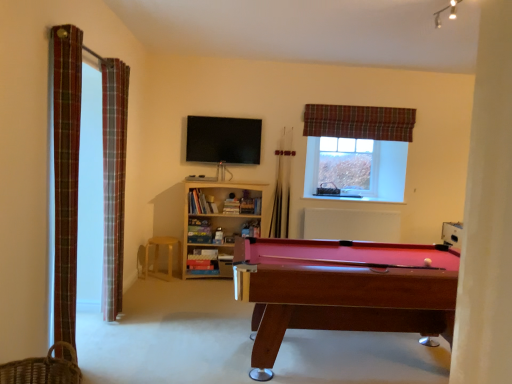
Question: Is rubberized wood pool table at lower right next to light wood/bookshelf at center and touching it?

Choices:
 (A) yes
 (B) no

Answer: (B)

Question: Is rubberized wood pool table at lower right thinner than light wood/bookshelf at center?

Choices:
 (A) no
 (B) yes

Answer: (A)

Question: Is rubberized wood pool table at lower right not near light wood/bookshelf at center?

Choices:
 (A) no
 (B) yes

Answer: (B)

Question: Considering the relative sizes of rubberized wood pool table at lower right and light wood/bookshelf at center in the image provided, is rubberized wood pool table at lower right shorter than light wood/bookshelf at center?

Choices:
 (A) no
 (B) yes

Answer: (B)

Question: From the image's perspective, is rubberized wood pool table at lower right beneath light wood/bookshelf at center?

Choices:
 (A) no
 (B) yes

Answer: (B)

Question: Is rubberized wood pool table at lower right to the right of light wood/bookshelf at center from the viewer's perspective?

Choices:
 (A) no
 (B) yes

Answer: (B)

Question: Is woven brown basket at lower left positioned beyond the bounds of clear plastic window screen at upper right?

Choices:
 (A) yes
 (B) no

Answer: (A)

Question: Is the depth of woven brown basket at lower left less than that of clear plastic window screen at upper right?

Choices:
 (A) no
 (B) yes

Answer: (B)

Question: Is woven brown basket at lower left looking in the opposite direction of clear plastic window screen at upper right?

Choices:
 (A) yes
 (B) no

Answer: (B)

Question: Does woven brown basket at lower left have a greater width compared to clear plastic window screen at upper right?

Choices:
 (A) no
 (B) yes

Answer: (B)

Question: Can clear plastic window screen at upper right be found inside woven brown basket at lower left?

Choices:
 (A) no
 (B) yes

Answer: (A)

Question: From a real-world perspective, is woven brown basket at lower left over clear plastic window screen at upper right?

Choices:
 (A) no
 (B) yes

Answer: (A)

Question: Is white matte radiator at center surrounded by light wood/bookshelf at center?

Choices:
 (A) yes
 (B) no

Answer: (B)